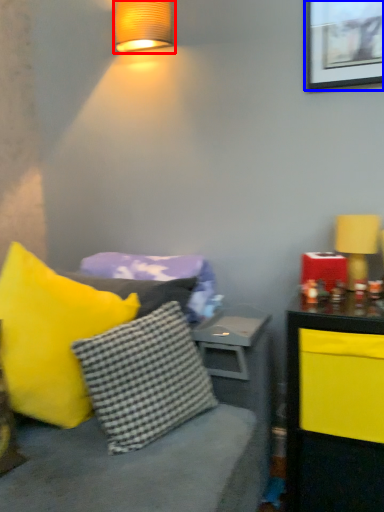
Question: Which object is further to the camera taking this photo, lamp (highlighted by a red box) or picture frame (highlighted by a blue box)?

Choices:
 (A) lamp
 (B) picture frame

Answer: (A)